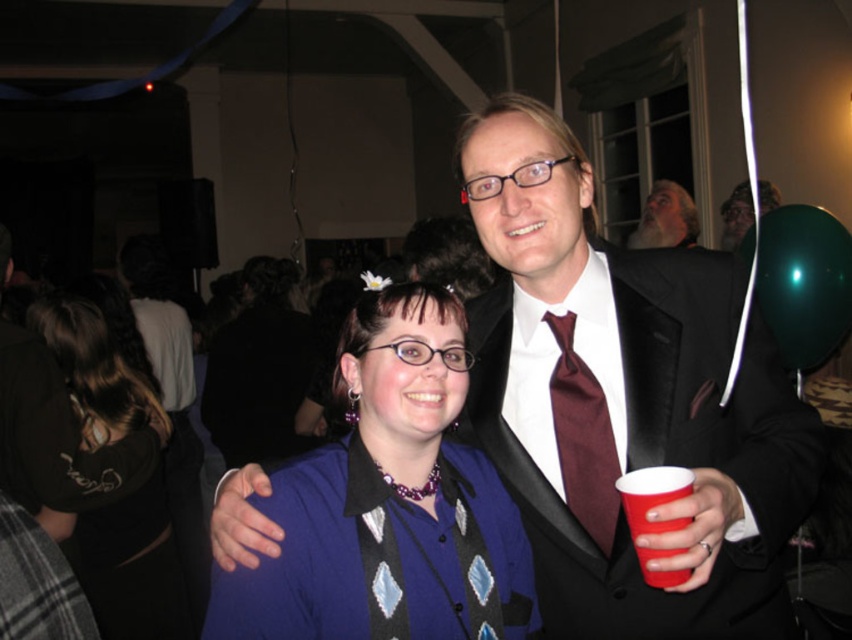
Question: Based on their relative distances, which object is nearer to the red plastic cup at right?

Choices:
 (A) matte black suit at upper center
 (B) gray beard at upper center
 (C) burgundy satin tie at right

Answer: (C)

Question: Among these points, which one is nearest to the camera?

Choices:
 (A) (821, 241)
 (B) (737, 241)
 (C) (635, 512)

Answer: (C)

Question: Which point is closer to the camera taking this photo?

Choices:
 (A) (131, 381)
 (B) (567, 378)

Answer: (B)

Question: Can you confirm if burgundy satin tie at right is positioned to the right of matte black suit at upper center?

Choices:
 (A) yes
 (B) no

Answer: (B)

Question: Does green rubber balloon at upper right appear under gray beard at upper center?

Choices:
 (A) no
 (B) yes

Answer: (B)

Question: Is red plastic cup at right above gray beard at upper center?

Choices:
 (A) yes
 (B) no

Answer: (B)